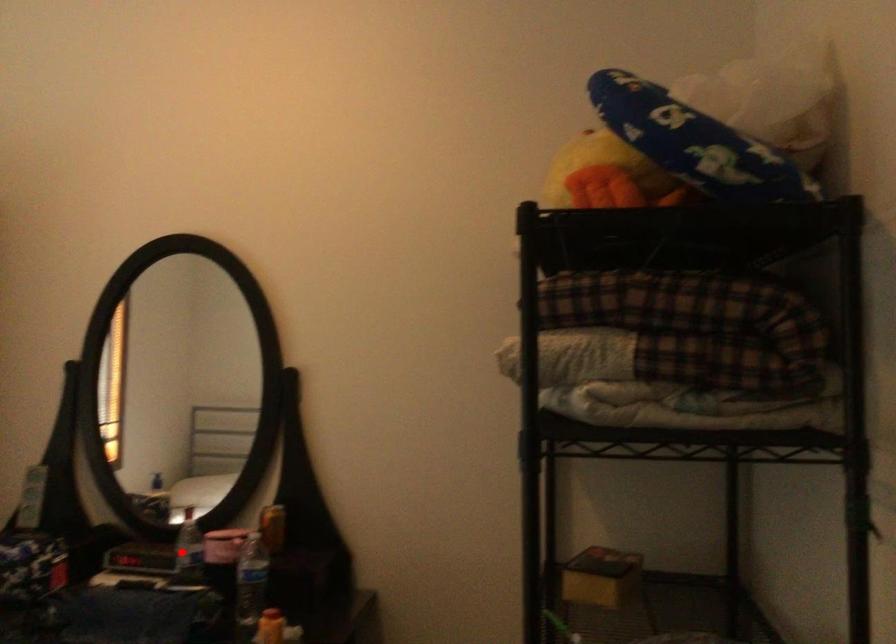
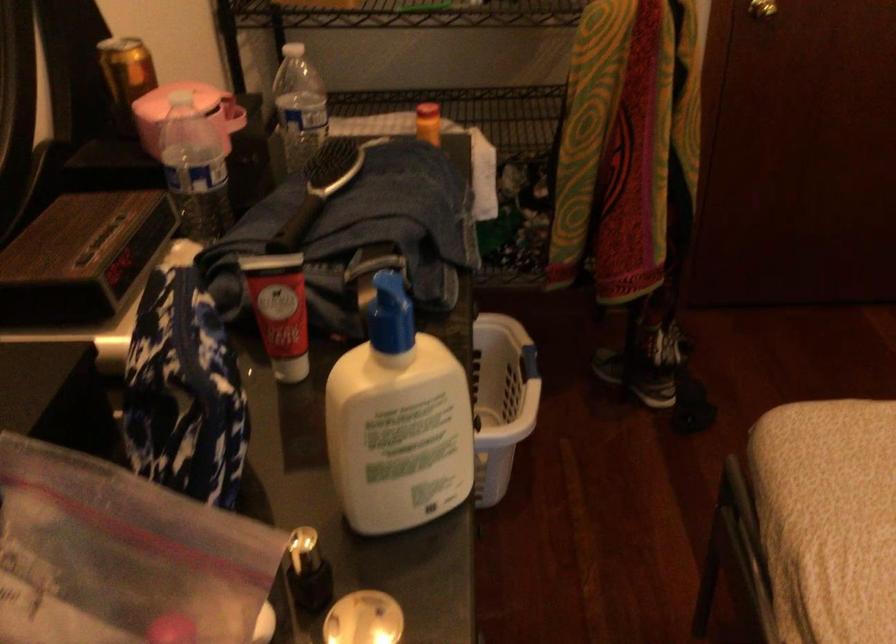
Question: I am providing you with two images of the same scene from different viewpoints. Given a red point in image1, look at the same physical point in image2. Is it:

Choices:
 (A) Closer to the viewpoint
 (B) Farther from the viewpoint

Answer: (A)